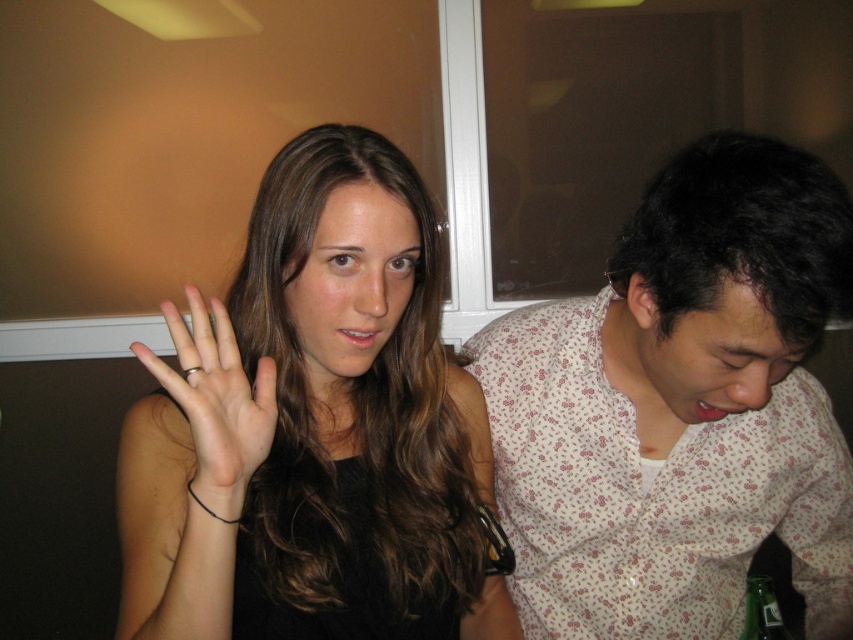
Can you confirm if matte black hand at center is positioned to the right of white floral shirt at right?

Incorrect, matte black hand at center is not on the right side of white floral shirt at right.

Between point (325, 589) and point (792, 429), which one is positioned behind?

Positioned behind is point (792, 429).

Locate an element on the screen. Image resolution: width=853 pixels, height=640 pixels. matte black hand at center is located at coordinates (314, 426).

Does white floral shirt at right appear under gold metallic ring at center?

Indeed, white floral shirt at right is positioned under gold metallic ring at center.

Measure the distance between white floral shirt at right and camera.

white floral shirt at right is 25.54 inches from camera.

Identify the location of white floral shirt at right. (680, 406).

Does matte black hand at center have a larger size compared to gold metallic ring at center?

Correct, matte black hand at center is larger in size than gold metallic ring at center.

This screenshot has height=640, width=853. What do you see at coordinates (314, 426) in the screenshot? I see `matte black hand at center` at bounding box center [314, 426].

The height and width of the screenshot is (640, 853). Find the location of `matte black hand at center`. matte black hand at center is located at coordinates (314, 426).